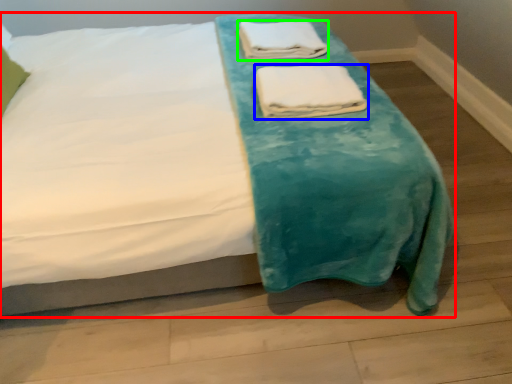
Question: Which object is positioned closest to bed (highlighted by a red box)? Select from towel (highlighted by a blue box) and towel (highlighted by a green box).

Choices:
 (A) towel
 (B) towel

Answer: (A)